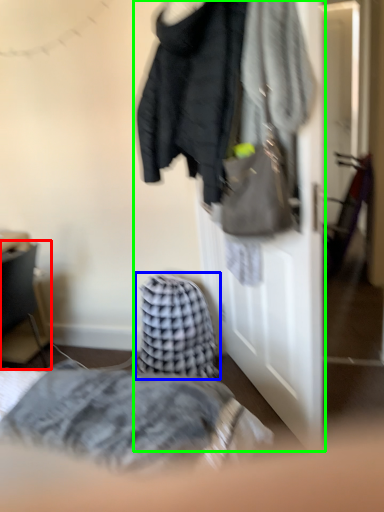
Question: Considering the real-world distances, which object is closest to furniture (highlighted by a red box)? blanket (highlighted by a blue box) or closet (highlighted by a green box).

Choices:
 (A) blanket
 (B) closet

Answer: (A)